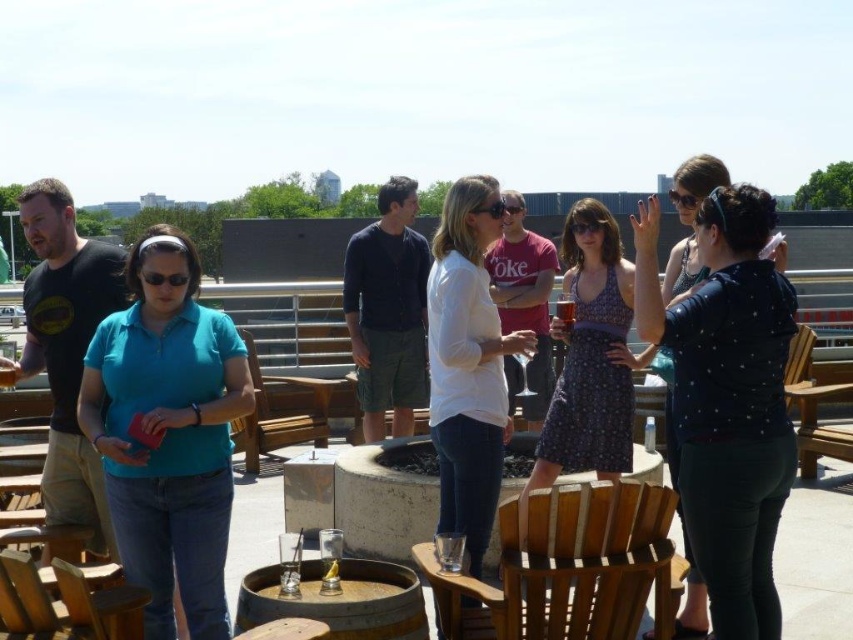
Measure the distance between matte black shirt at center and patterned fabric dress at center.

The distance of matte black shirt at center from patterned fabric dress at center is 1.44 meters.

Can you confirm if matte black shirt at center is wider than patterned fabric dress at center?

Yes, matte black shirt at center is wider than patterned fabric dress at center.

What do you see at coordinates (727, 401) in the screenshot? Image resolution: width=853 pixels, height=640 pixels. I see `matte black shirt at center` at bounding box center [727, 401].

Identify the location of matte black shirt at center. (727, 401).

Who is higher up, teal fabric shirt at left or wooden chair at center?

Positioned higher is teal fabric shirt at left.

Is point (117, 348) positioned behind point (328, 384)?

No, it is in front of (328, 384).

Identify the location of teal fabric shirt at left. (167, 433).

The height and width of the screenshot is (640, 853). What do you see at coordinates (167, 433) in the screenshot? I see `teal fabric shirt at left` at bounding box center [167, 433].

Can you confirm if teal fabric shirt at left is thinner than white matte shirt at center?

Incorrect, teal fabric shirt at left's width is not less than white matte shirt at center's.

Is point (149, 264) farther from camera compared to point (521, 342)?

No, (149, 264) is in front of (521, 342).

Where is `teal fabric shirt at left`? teal fabric shirt at left is located at coordinates (167, 433).